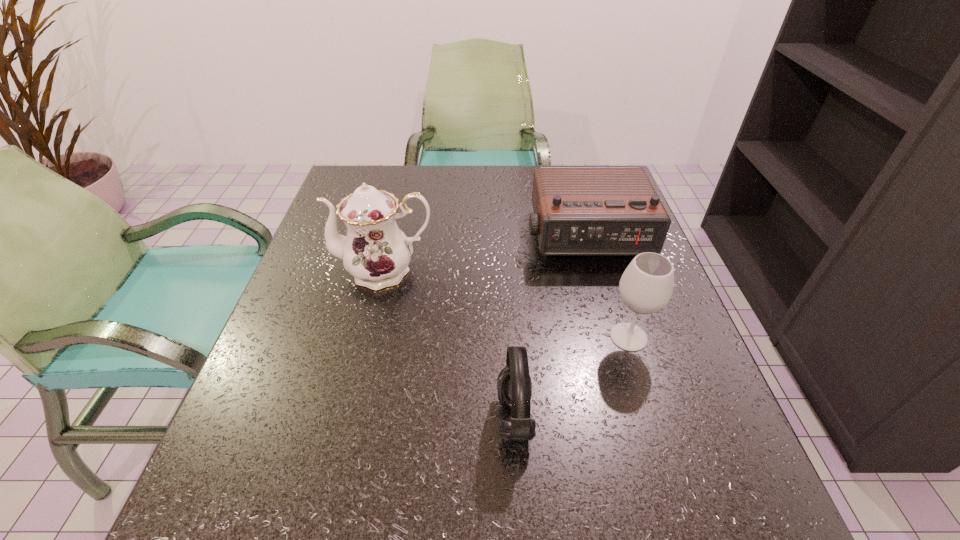
I want to click on free area in between the third farthest object and the radio receiver, so click(607, 286).

The width and height of the screenshot is (960, 540). I want to click on free area in between the radio receiver and the second tallest object, so click(607, 286).

Select which object appears as the second closest to the radio receiver. Please provide its 2D coordinates. Your answer should be formatted as a tuple, i.e. [(x, y)], where the tuple contains the x and y coordinates of a point satisfying the conditions above.

[(375, 252)]

Locate which object is the third closest to the leftmost object. Please provide its 2D coordinates. Your answer should be formatted as a tuple, i.e. [(x, y)], where the tuple contains the x and y coordinates of a point satisfying the conditions above.

[(646, 286)]

The height and width of the screenshot is (540, 960). I want to click on blank area in the image that satisfies the following two spatial constraints: 1. on the front side of the wineglass; 2. on the left side of the chinaware, so coord(370,337).

Locate an element on the screen. The height and width of the screenshot is (540, 960). free location that satisfies the following two spatial constraints: 1. on the tuning display of the radio receiver; 2. on the earcups of the nearest object is located at coordinates (636, 418).

I want to click on free space that satisfies the following two spatial constraints: 1. on the front side of the wineglass; 2. on the right side of the leftmost object, so click(370, 337).

You are a GUI agent. You are given a task and a screenshot of the screen. Output one action in this format:
    pyautogui.click(x=<x>, y=<y>)
    Task: Click on the free space that satisfies the following two spatial constraints: 1. on the tuning display of the radio receiver; 2. on the earcups of the third object from right to left
    The height and width of the screenshot is (540, 960).
    Given the screenshot: What is the action you would take?
    pyautogui.click(x=636, y=418)